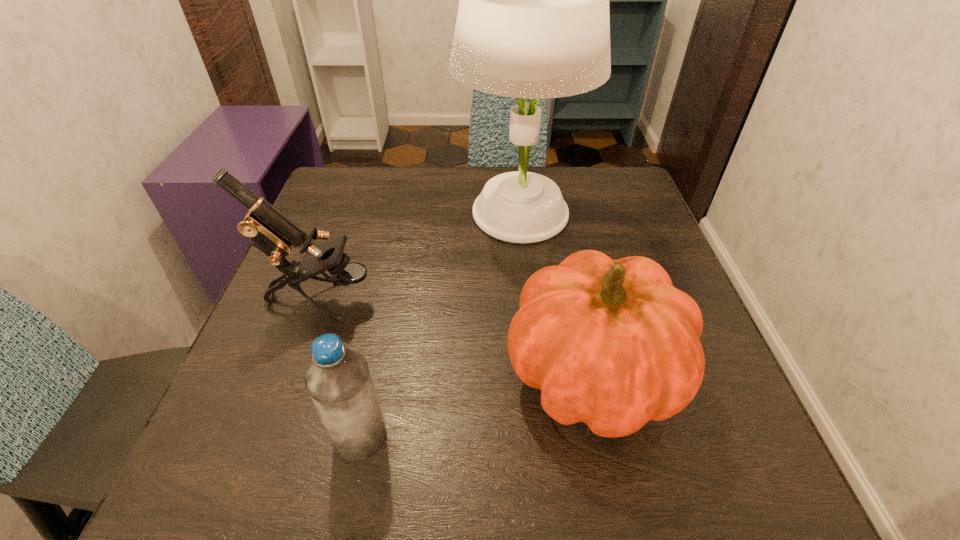
I want to click on lamp, so click(x=533, y=22).

I want to click on the farthest object, so click(533, 22).

Locate an element on the screen. microscope is located at coordinates (270, 231).

At what (x,y) coordinates should I click in order to perform the action: click on pumpkin. Please return your answer as a coordinate pair (x, y). The height and width of the screenshot is (540, 960). Looking at the image, I should click on (612, 343).

This screenshot has width=960, height=540. What are the coordinates of `the shortest object` in the screenshot? It's located at (338, 380).

This screenshot has height=540, width=960. What are the coordinates of `vacant space located on the front-facing side of the farthest object` in the screenshot? It's located at [373, 213].

I want to click on free space located on the front-facing side of the farthest object, so click(361, 213).

The height and width of the screenshot is (540, 960). I want to click on vacant space located on the front-facing side of the farthest object, so 361,213.

Locate an element on the screen. vacant space situated 0.100m through the eyepiece of the microscope is located at coordinates (423, 300).

Find the location of a particular element. The width and height of the screenshot is (960, 540). free space located 0.320m on the back of the pumpkin is located at coordinates (557, 212).